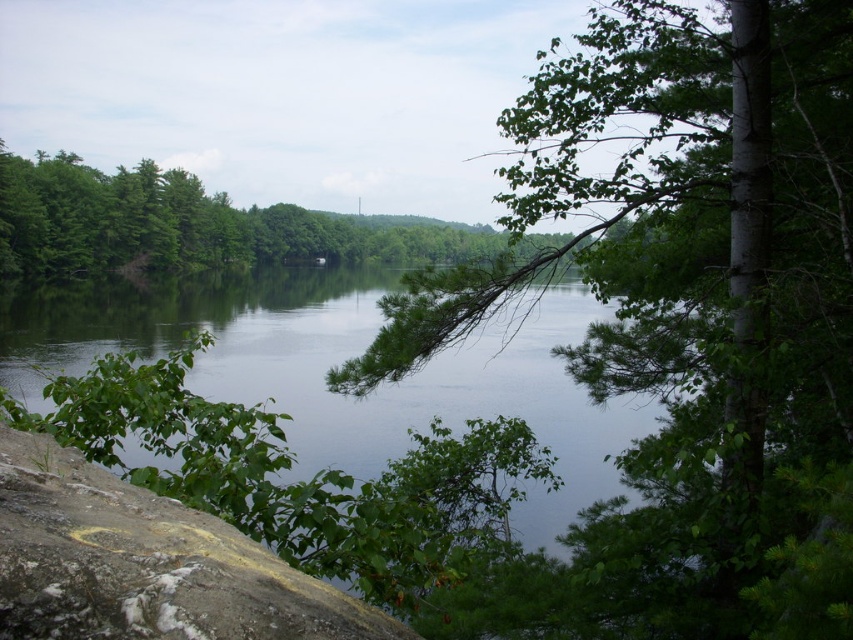
Question: Which point is farther from the camera taking this photo?

Choices:
 (A) (325, 636)
 (B) (399, 406)

Answer: (B)

Question: Is green leafy river at center above yellowish rock at lower left?

Choices:
 (A) no
 (B) yes

Answer: (B)

Question: Is green leafy branch at center right wider than green leafy river at center?

Choices:
 (A) no
 (B) yes

Answer: (A)

Question: Which of the following is the farthest from the observer?

Choices:
 (A) green leafy branch at center right
 (B) green leafy tree at center
 (C) yellowish rock at lower left

Answer: (B)

Question: Which object is positioned closest to the green leafy tree at center?

Choices:
 (A) green leafy branch at center right
 (B) yellowish rock at lower left

Answer: (A)

Question: Can you confirm if green leafy branch at center right is positioned above yellowish rock at lower left?

Choices:
 (A) no
 (B) yes

Answer: (B)